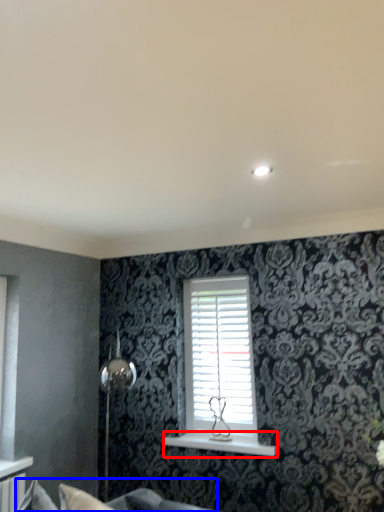
Question: Which object is closer to the camera taking this photo, window sill (highlighted by a red box) or couch (highlighted by a blue box)?

Choices:
 (A) window sill
 (B) couch

Answer: (B)